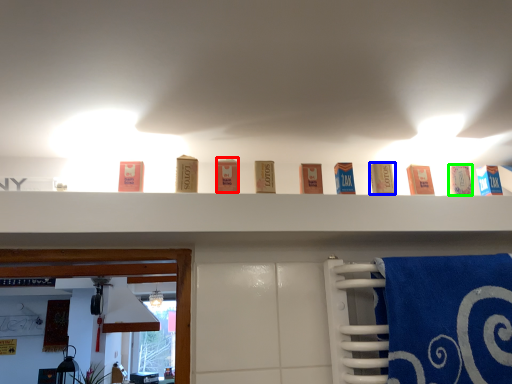
Question: Which object is positioned farthest from product (highlighted by a red box)? Select from product (highlighted by a blue box) and product (highlighted by a green box).

Choices:
 (A) product
 (B) product

Answer: (B)